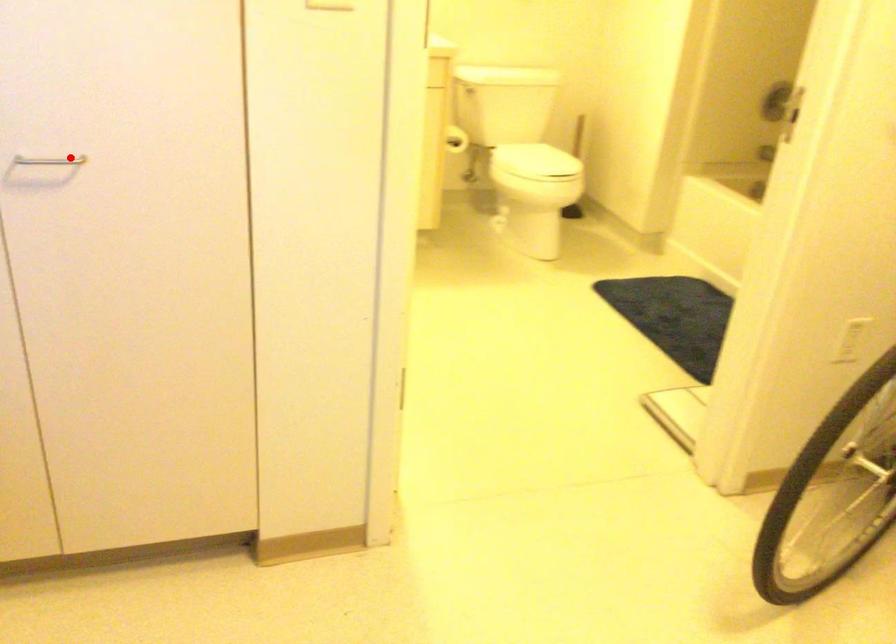
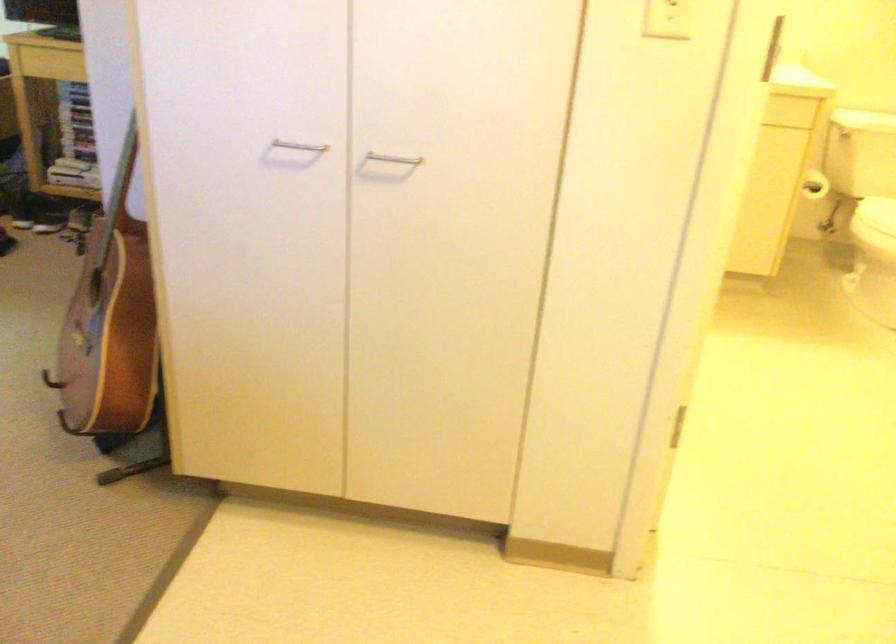
The point at the highlighted location is marked in the first image. Where is the corresponding point in the second image?

(393, 158)